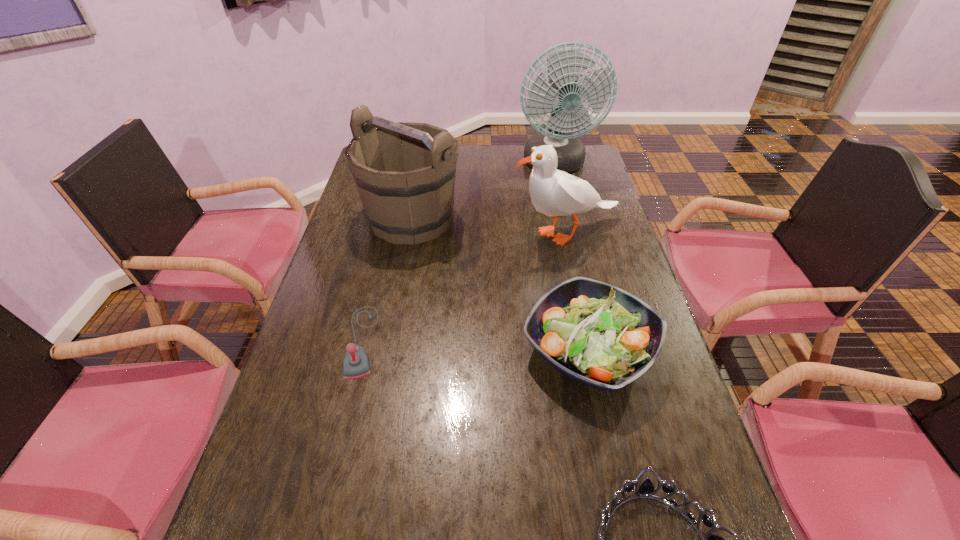
Find the location of a particular element. vacant space located 0.100m at the beak of the gull is located at coordinates (478, 234).

The height and width of the screenshot is (540, 960). Find the location of `blank space located on the front of the salad plate`. blank space located on the front of the salad plate is located at coordinates point(611,451).

You are a GUI agent. You are given a task and a screenshot of the screen. Output one action in this format:
    pyautogui.click(x=<x>, y=<y>)
    Task: Click on the vacant space positioned 0.350m on the right of the joystick
    The width and height of the screenshot is (960, 540).
    Given the screenshot: What is the action you would take?
    pyautogui.click(x=517, y=341)

At what (x,y) coordinates should I click in order to perform the action: click on object located in the far edge section of the desktop. Please return your answer as a coordinate pair (x, y). The width and height of the screenshot is (960, 540). Looking at the image, I should click on coord(561,98).

At what (x,y) coordinates should I click in order to perform the action: click on bucket that is at the left edge. Please return your answer as a coordinate pair (x, y). Looking at the image, I should click on (401, 208).

Where is `joystick that is at the left edge`? Image resolution: width=960 pixels, height=540 pixels. joystick that is at the left edge is located at coordinates (356, 364).

Locate an element on the screen. The width and height of the screenshot is (960, 540). fan present at the right edge is located at coordinates (561, 98).

Identify the location of gull that is at the right edge. (553, 192).

Image resolution: width=960 pixels, height=540 pixels. I want to click on salad plate at the right edge, so click(x=595, y=333).

At what (x,y) coordinates should I click in order to perform the action: click on object that is at the far right corner. Please return your answer as a coordinate pair (x, y). This screenshot has height=540, width=960. Looking at the image, I should click on (561, 98).